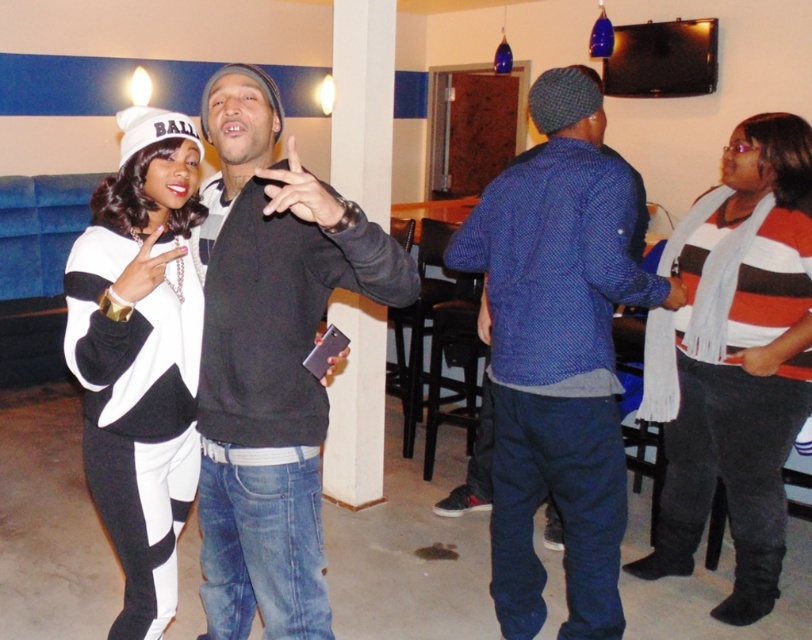
In the scene shown: Between black matte sweatshirt at center and striped wool scarf at right, which one has less height?

black matte sweatshirt at center

Does black matte sweatshirt at center appear over striped wool scarf at right?

No, black matte sweatshirt at center is not above striped wool scarf at right.

This screenshot has width=812, height=640. Describe the element at coordinates (270, 360) in the screenshot. I see `black matte sweatshirt at center` at that location.

This screenshot has height=640, width=812. Find the location of `black matte sweatshirt at center`. black matte sweatshirt at center is located at coordinates [270, 360].

Describe the element at coordinates (733, 358) in the screenshot. The height and width of the screenshot is (640, 812). I see `striped wool scarf at right` at that location.

Is striped wool scarf at right above white matte/black sweater at left?

Indeed, striped wool scarf at right is positioned over white matte/black sweater at left.

Who is more forward, (771, 353) or (173, 544)?

Point (173, 544) is in front.

Locate an element on the screen. The width and height of the screenshot is (812, 640). striped wool scarf at right is located at coordinates (733, 358).

Between black matte sweatshirt at center and blue textured sweater at center, which one appears on the right side from the viewer's perspective?

blue textured sweater at center

Is point (266, 508) less distant than point (573, 141)?

Yes, it is.

Who is more forward, (257, 234) or (525, 465)?

Point (257, 234) is in front.

Identify the location of black matte sweatshirt at center. This screenshot has height=640, width=812. (270, 360).